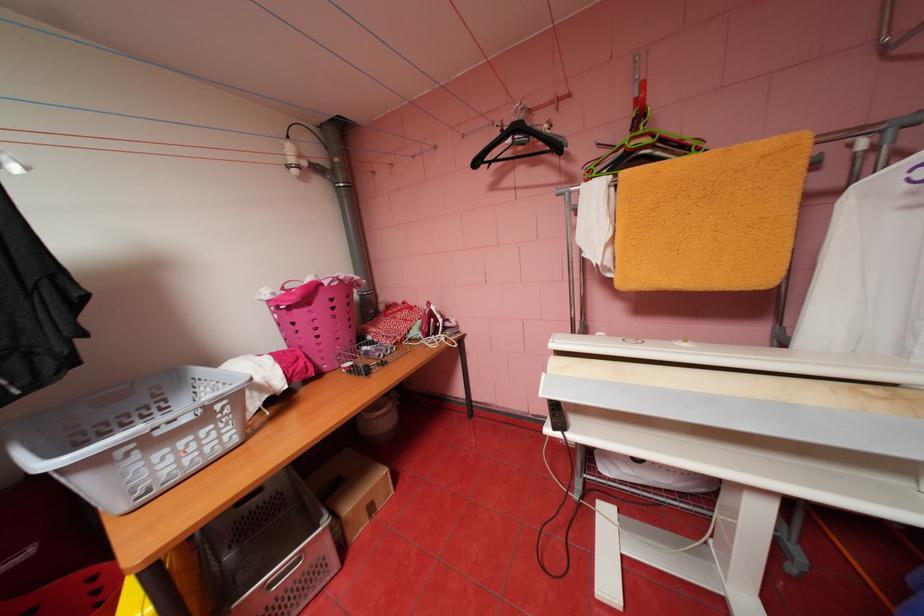
Find the location of a particular element. ironing press handle is located at coordinates (439, 323).